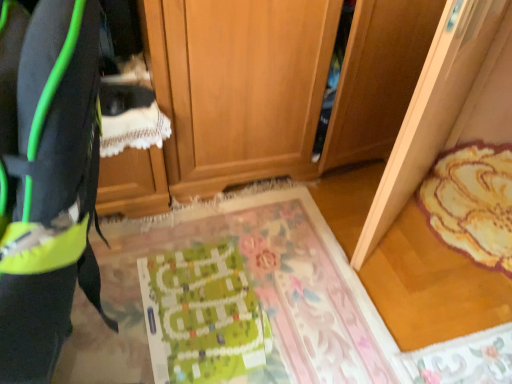
Image resolution: width=512 pixels, height=384 pixels. In order to click on green paper at center in this screenshot , I will do `click(202, 315)`.

Measure the distance between point (37, 184) and camera.

16.30 inches.

At what (x,y) coordinates should I click in order to perform the action: click on neon green fabric at left. Please return your answer as a coordinate pair (x, y). The height and width of the screenshot is (384, 512). Looking at the image, I should click on (47, 181).

Find the location of a particular element. Image resolution: width=512 pixels, height=384 pixels. wooden cabinet at center is located at coordinates (280, 84).

Which is closer to the camera, (x=156, y=274) or (x=499, y=204)?

The point (x=156, y=274) is in front.

Which is more to the left, green paper at center or floral fabric rug at right, which ranks as the 2th mat in left-to-right order?

From the viewer's perspective, green paper at center appears more on the left side.

Considering the relative sizes of green paper at center and floral fabric rug at right, which ranks as the 2th mat in left-to-right order, in the image provided, is green paper at center shorter than floral fabric rug at right, which ranks as the 2th mat in left-to-right order,?

Indeed, green paper at center has a lesser height compared to floral fabric rug at right, which ranks as the 2th mat in left-to-right order.

From a real-world perspective, relative to floral fabric rug at right, positioned as the first mat in right-to-left order, is neon green fabric at left vertically above or below?

Clearly, from a real-world perspective, neon green fabric at left is above floral fabric rug at right, positioned as the first mat in right-to-left order.

Identify the location of wide lying below the floral fabric rug at right, which ranks as the 2th mat in left-to-right order (from the image's perspective). (47, 181).

Can you confirm if neon green fabric at left is shorter than floral fabric rug at right, which ranks as the 2th mat in left-to-right order?

In fact, neon green fabric at left may be taller than floral fabric rug at right, which ranks as the 2th mat in left-to-right order.

Can you confirm if neon green fabric at left is positioned to the left of floral fabric rug at right, which ranks as the 2th mat in left-to-right order?

Yes, neon green fabric at left is to the left of floral fabric rug at right, which ranks as the 2th mat in left-to-right order.

Which is behind, point (335, 286) or point (52, 52)?

The point (335, 286) is farther.

Would you say green fabric mat at center, arranged as the 1th mat when viewed from the left, contains neon green fabric at left?

That's incorrect, neon green fabric at left is not inside green fabric mat at center, arranged as the 1th mat when viewed from the left.

Is green fabric mat at center, which is the second mat in right-to-left order, facing away from neon green fabric at left?

No.

Is green fabric mat at center, which is the second mat in right-to-left order, bigger than neon green fabric at left?

No, green fabric mat at center, which is the second mat in right-to-left order, is not bigger than neon green fabric at left.

Is point (113, 237) positioned after point (260, 8)?

Yes, point (113, 237) is farther from viewer.

Who is more distant, green fabric mat at center, arranged as the 1th mat when viewed from the left, or wooden cabinet at center?

wooden cabinet at center.

Based on their sizes in the image, would you say green fabric mat at center, which is the second mat in right-to-left order, is bigger or smaller than wooden cabinet at center?

Considering their sizes, green fabric mat at center, which is the second mat in right-to-left order, takes up less space than wooden cabinet at center.

Measure the distance between green fabric mat at center, which is the second mat in right-to-left order, and wooden cabinet at center.

19.79 inches.

Is wooden cabinet at center facing away from green fabric mat at center, which is the second mat in right-to-left order?

No, green fabric mat at center, which is the second mat in right-to-left order, is not at the back of wooden cabinet at center.

From the image's perspective, which one is positioned higher, wooden cabinet at center or green fabric mat at center, which is the second mat in right-to-left order?

wooden cabinet at center appears higher in the image.

Is wooden cabinet at center not near green fabric mat at center, arranged as the 1th mat when viewed from the left?

They are positioned close to each other.

Is wooden cabinet at center outside of green fabric mat at center, arranged as the 1th mat when viewed from the left?

wooden cabinet at center lies outside green fabric mat at center, arranged as the 1th mat when viewed from the left,'s area.

From a real-world perspective, which object rests below the other?

floral fabric rug at right, which ranks as the 2th mat in left-to-right order, is physically lower.

Is green fabric mat at center, arranged as the 1th mat when viewed from the left, positioned with its back to floral fabric rug at right, positioned as the first mat in right-to-left order?

No, green fabric mat at center, arranged as the 1th mat when viewed from the left, is not facing away from floral fabric rug at right, positioned as the first mat in right-to-left order.

In terms of width, does green fabric mat at center, arranged as the 1th mat when viewed from the left, look wider or thinner when compared to floral fabric rug at right, positioned as the first mat in right-to-left order?

Clearly, green fabric mat at center, arranged as the 1th mat when viewed from the left, has more width compared to floral fabric rug at right, positioned as the first mat in right-to-left order.

Which is more to the right, green fabric mat at center, arranged as the 1th mat when viewed from the left, or floral fabric rug at right, which ranks as the 2th mat in left-to-right order?

floral fabric rug at right, which ranks as the 2th mat in left-to-right order.

Which is more to the left, neon green fabric at left or green fabric mat at center, which is the second mat in right-to-left order?

neon green fabric at left.

Does neon green fabric at left contain green fabric mat at center, arranged as the 1th mat when viewed from the left?

No.

Does point (85, 106) lie behind point (170, 326)?

No, (85, 106) is closer to viewer.

Does neon green fabric at left have a lesser height compared to green fabric mat at center, which is the second mat in right-to-left order?

No, neon green fabric at left is not shorter than green fabric mat at center, which is the second mat in right-to-left order.

In order to click on the 2nd mat above when counting from the green paper at center (from the image's perspective) in this screenshot , I will do `click(472, 202)`.

At what (x,y) coordinates should I click in order to perform the action: click on wide in front of the floral fabric rug at right, positioned as the first mat in right-to-left order. Please return your answer as a coordinate pair (x, y). This screenshot has height=384, width=512. Looking at the image, I should click on (47, 181).

Which object lies further to the anchor point green fabric mat at center, which is the second mat in right-to-left order, neon green fabric at left or green paper at center?

neon green fabric at left.

Which object lies further to the anchor point neon green fabric at left, green paper at center or floral fabric rug at right, which ranks as the 2th mat in left-to-right order?

floral fabric rug at right, which ranks as the 2th mat in left-to-right order.

Estimate the real-world distances between objects in this image. Which object is closer to green paper at center, wooden cabinet at center or neon green fabric at left?

wooden cabinet at center lies closer to green paper at center than the other object.

In the scene shown: Which object lies nearer to the anchor point green paper at center, wooden cabinet at center or green fabric mat at center, which is the second mat in right-to-left order?

Among the two, green fabric mat at center, which is the second mat in right-to-left order, is located nearer to green paper at center.

Looking at the image, which one is located further to neon green fabric at left, floral fabric rug at right, which ranks as the 2th mat in left-to-right order, or wooden cabinet at center?

floral fabric rug at right, which ranks as the 2th mat in left-to-right order, is positioned further to the anchor neon green fabric at left.

Looking at the image, which one is located closer to neon green fabric at left, wooden cabinet at center or green fabric mat at center, which is the second mat in right-to-left order?

The object closer to neon green fabric at left is green fabric mat at center, which is the second mat in right-to-left order.

Considering their positions, is neon green fabric at left positioned closer to floral fabric rug at right, which ranks as the 2th mat in left-to-right order, than green fabric mat at center, which is the second mat in right-to-left order?

The object closer to floral fabric rug at right, which ranks as the 2th mat in left-to-right order, is green fabric mat at center, which is the second mat in right-to-left order.

When comparing their distances from green paper at center, does floral fabric rug at right, positioned as the first mat in right-to-left order, or wooden cabinet at center seem closer?

wooden cabinet at center lies closer to green paper at center than the other object.

This screenshot has height=384, width=512. I want to click on mat between neon green fabric at left and green paper at center in the front-back direction, so click(x=227, y=299).

Locate an element on the screen. mat between neon green fabric at left and floral fabric rug at right, which ranks as the 2th mat in left-to-right order, from left to right is located at coordinates (227, 299).

What are the coordinates of `mat between green paper at center and floral fabric rug at right, positioned as the first mat in right-to-left order, in the horizontal direction` in the screenshot? It's located at (227, 299).

The height and width of the screenshot is (384, 512). Find the location of `cabinetry between neon green fabric at left and floral fabric rug at right, which ranks as the 2th mat in left-to-right order, in the horizontal direction`. cabinetry between neon green fabric at left and floral fabric rug at right, which ranks as the 2th mat in left-to-right order, in the horizontal direction is located at coordinates (280, 84).